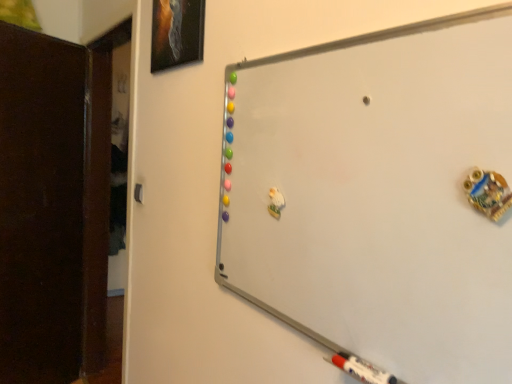
At what (x,y) coordinates should I click in order to perform the action: click on dark wood door at left. Please return your answer as a coordinate pair (x, y). This screenshot has width=512, height=384. Looking at the image, I should click on (41, 206).

What do you see at coordinates (41, 206) in the screenshot? I see `dark wood door at left` at bounding box center [41, 206].

Describe the element at coordinates (378, 195) in the screenshot. This screenshot has height=384, width=512. I see `whiteboard at upper right` at that location.

Where is `dark wood door at left`? The width and height of the screenshot is (512, 384). dark wood door at left is located at coordinates (41, 206).

Is whiteboard at upper right oriented away from dark wood door at left?

No.

From a real-world perspective, is whiteboard at upper right physically located above or below dark wood door at left?

whiteboard at upper right is situated higher than dark wood door at left in the real world.

Considering the positions of point (364, 255) and point (59, 48), is point (364, 255) closer or farther from the camera than point (59, 48)?

Point (364, 255) is positioned closer to the camera compared to point (59, 48).

From the picture: Is whiteboard at upper right placed right next to dark wood door at left?

There is a gap between whiteboard at upper right and dark wood door at left.

Which object is positioned more to the left, matte black picture frame at upper left or dark wood door at left?

Positioned to the left is dark wood door at left.

From a real-world perspective, which object rests below the other?

dark wood door at left.

I want to click on door on the left of matte black picture frame at upper left, so 41,206.

Is the depth of matte black picture frame at upper left less than that of dark wood door at left?

Yes, matte black picture frame at upper left is in front of dark wood door at left.

Who is shorter, whiteboard at upper right or matte black picture frame at upper left?

matte black picture frame at upper left.

In the image, is whiteboard at upper right positioned in front of or behind matte black picture frame at upper left?

Clearly, whiteboard at upper right is in front of matte black picture frame at upper left.

This screenshot has height=384, width=512. Find the location of `picture frame behind the whiteboard at upper right`. picture frame behind the whiteboard at upper right is located at coordinates (177, 33).

Could you tell me if matte black picture frame at upper left is turned towards whiteboard at upper right?

No, matte black picture frame at upper left is not facing towards whiteboard at upper right.

Is the position of matte black picture frame at upper left more distant than that of whiteboard at upper right?

Yes, the depth of matte black picture frame at upper left is greater than that of whiteboard at upper right.

From a real-world perspective, who is located higher, matte black picture frame at upper left or whiteboard at upper right?

In real-world perspective, matte black picture frame at upper left is above.

Which object is positioned more to the left, dark wood door at left or matte black picture frame at upper left?

dark wood door at left.

Do you think dark wood door at left is within matte black picture frame at upper left, or outside of it?

dark wood door at left is spatially situated outside matte black picture frame at upper left.

In the scene shown: Is dark wood door at left facing towards matte black picture frame at upper left?

Yes, dark wood door at left is turned towards matte black picture frame at upper left.

How different are the orientations of dark wood door at left and matte black picture frame at upper left in degrees?

dark wood door at left and matte black picture frame at upper left are facing 120 degrees away from each other.

Is dark wood door at left to the right of whiteboard at upper right from the viewer's perspective?

In fact, dark wood door at left is to the left of whiteboard at upper right.

Is dark wood door at left spatially inside whiteboard at upper right, or outside of it?

dark wood door at left is not inside whiteboard at upper right, it's outside.

Which of these two, dark wood door at left or whiteboard at upper right, is bigger?

Bigger between the two is dark wood door at left.

Looking at this image, how different are the orientations of dark wood door at left and whiteboard at upper right in degrees?

The angular difference between dark wood door at left and whiteboard at upper right is 120 degrees.

Locate an element on the screen. The width and height of the screenshot is (512, 384). door located behind the whiteboard at upper right is located at coordinates (41, 206).

Locate an element on the screen. Image resolution: width=512 pixels, height=384 pixels. picture frame above the dark wood door at left (from the image's perspective) is located at coordinates (177, 33).

Based on their spatial positions, is dark wood door at left or matte black picture frame at upper left closer to whiteboard at upper right?

matte black picture frame at upper left is closer to whiteboard at upper right.

In the scene shown: Estimate the real-world distances between objects in this image. Which object is closer to matte black picture frame at upper left, dark wood door at left or whiteboard at upper right?

whiteboard at upper right is closer to matte black picture frame at upper left.

Looking at the image, which one is located closer to dark wood door at left, matte black picture frame at upper left or whiteboard at upper right?

matte black picture frame at upper left is closer to dark wood door at left.

Looking at the image, which one is located further to whiteboard at upper right, matte black picture frame at upper left or dark wood door at left?

Among the two, dark wood door at left is located further to whiteboard at upper right.

Looking at this image, from the image, which object appears to be nearer to matte black picture frame at upper left, whiteboard at upper right or dark wood door at left?

whiteboard at upper right is positioned closer to the anchor matte black picture frame at upper left.

Which object lies nearer to the anchor point dark wood door at left, whiteboard at upper right or matte black picture frame at upper left?

matte black picture frame at upper left.

Find the location of `picture frame between whiteboard at upper right and dark wood door at left from front to back`. picture frame between whiteboard at upper right and dark wood door at left from front to back is located at coordinates (177, 33).